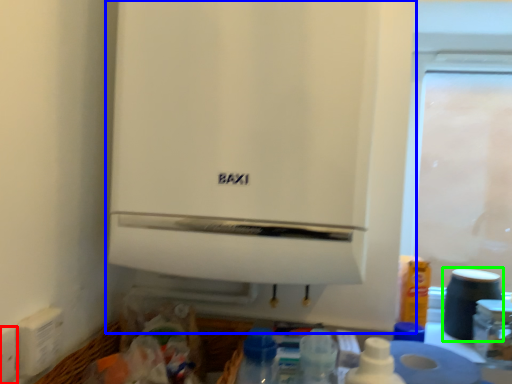
Question: Which object is positioned farthest from electric outlet (highlighted by a red box)? Select from home appliance (highlighted by a blue box) and appliance (highlighted by a green box).

Choices:
 (A) home appliance
 (B) appliance

Answer: (B)